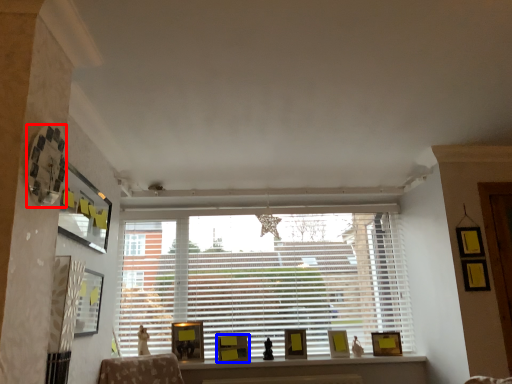
Question: Which object appears farthest to the camera in this image, picture frame (highlighted by a red box) or picture frame (highlighted by a blue box)?

Choices:
 (A) picture frame
 (B) picture frame

Answer: (B)